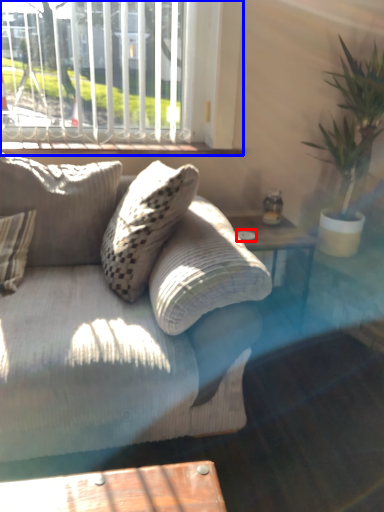
Question: Which point is closer to the camera, glass plate (highlighted by a red box) or window (highlighted by a blue box)?

Choices:
 (A) glass plate
 (B) window

Answer: (B)